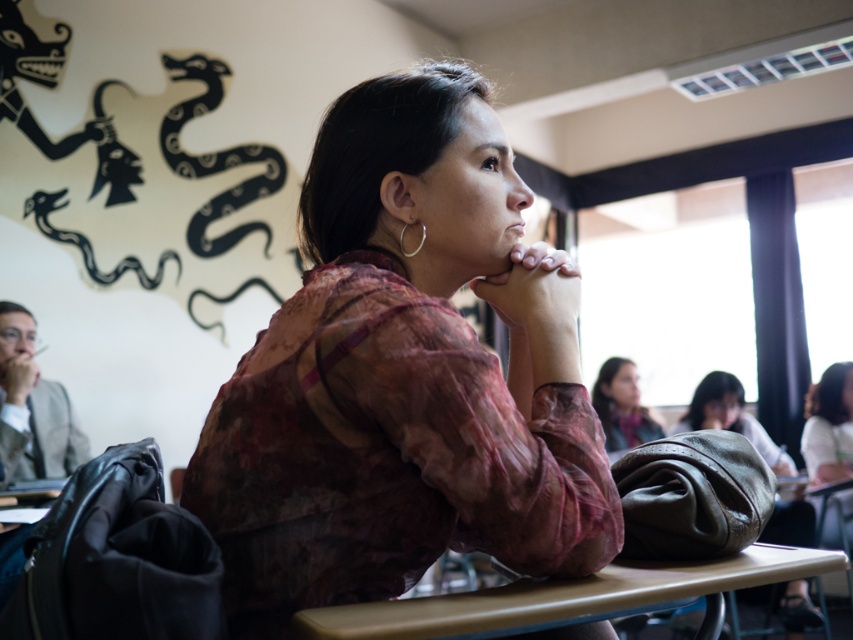
Question: Which point appears closest to the camera in this image?

Choices:
 (A) (416, 636)
 (B) (430, 260)
 (C) (757, 589)

Answer: (A)

Question: From the image, what is the correct spatial relationship of light brown plastic table at center in relation to smooth skin hands at center?

Choices:
 (A) above
 (B) below

Answer: (B)

Question: Which of the following is the closest to the observer?

Choices:
 (A) (549, 256)
 (B) (459, 634)
 (C) (630, 413)

Answer: (B)

Question: Which object is closer to the camera taking this photo?

Choices:
 (A) leather bag at center
 (B) light brown plastic table at center
 (C) matte pink blouse at center

Answer: (B)

Question: Is matte pink blouse at center in front of smooth brown hair at upper right?

Choices:
 (A) no
 (B) yes

Answer: (B)

Question: Can you confirm if matte pink blouse at center is wider than leather bag at center?

Choices:
 (A) no
 (B) yes

Answer: (A)